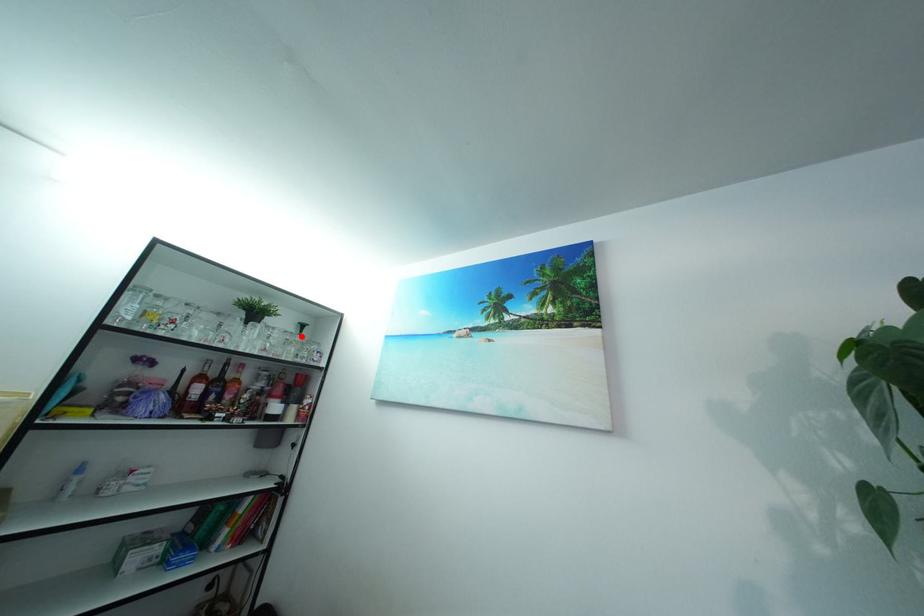
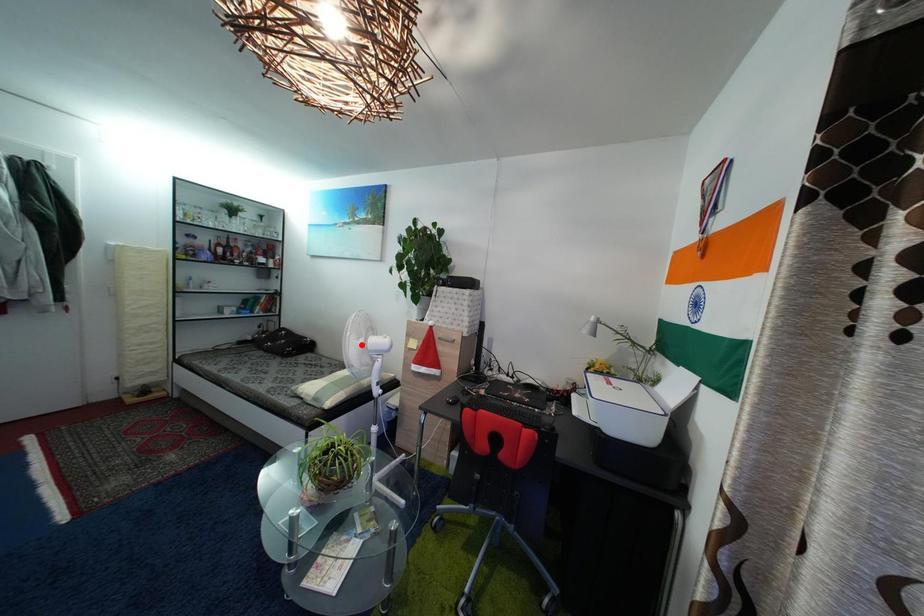
I am providing you with two images of the same scene from different viewpoints. A red point is marked on the first image and another point is marked on the second image. Is the red point in image1 aligned with the point shown in image2?

No